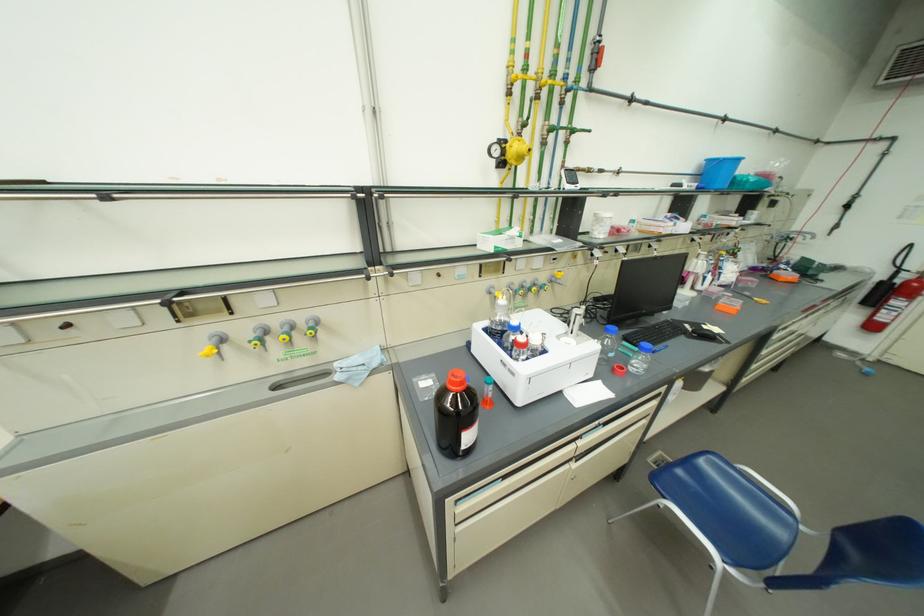
Locate an element on the screen. This screenshot has height=616, width=924. black computer mouse is located at coordinates (704, 333).